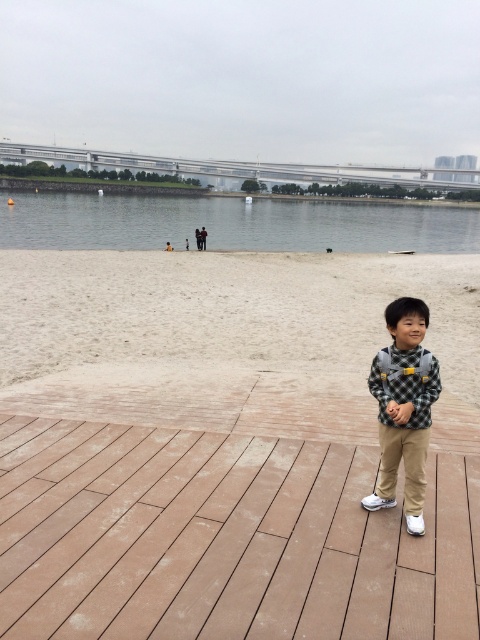
Is brown wood deck at center to the right of white sand at lower center from the viewer's perspective?

In fact, brown wood deck at center is to the left of white sand at lower center.

Between brown wood deck at center and white sand at lower center, which one appears on the right side from the viewer's perspective?

white sand at lower center

Who is more distant from viewer, (286,604) or (360,305)?

The point (360,305) is more distant.

Locate an element on the screen. The width and height of the screenshot is (480, 640). brown wood deck at center is located at coordinates (224, 538).

Which is below, brown wood deck at center or checkered fabric shirt at center?

brown wood deck at center

At what (x,y) coordinates should I click in order to perform the action: click on brown wood deck at center. Please return your answer as a coordinate pair (x, y). Looking at the image, I should click on (224, 538).

Is point (33, 580) positioned before point (392, 429)?

Yes, it is in front of point (392, 429).

Image resolution: width=480 pixels, height=640 pixels. I want to click on brown wood deck at center, so click(x=224, y=538).

The width and height of the screenshot is (480, 640). What do you see at coordinates (224, 538) in the screenshot?
I see `brown wood deck at center` at bounding box center [224, 538].

Which is below, brown wood deck at center or clear water at lower center?

Positioned lower is brown wood deck at center.

Which is in front, point (45, 516) or point (119, 220)?

Point (45, 516)

Image resolution: width=480 pixels, height=640 pixels. I want to click on brown wood deck at center, so click(224, 538).